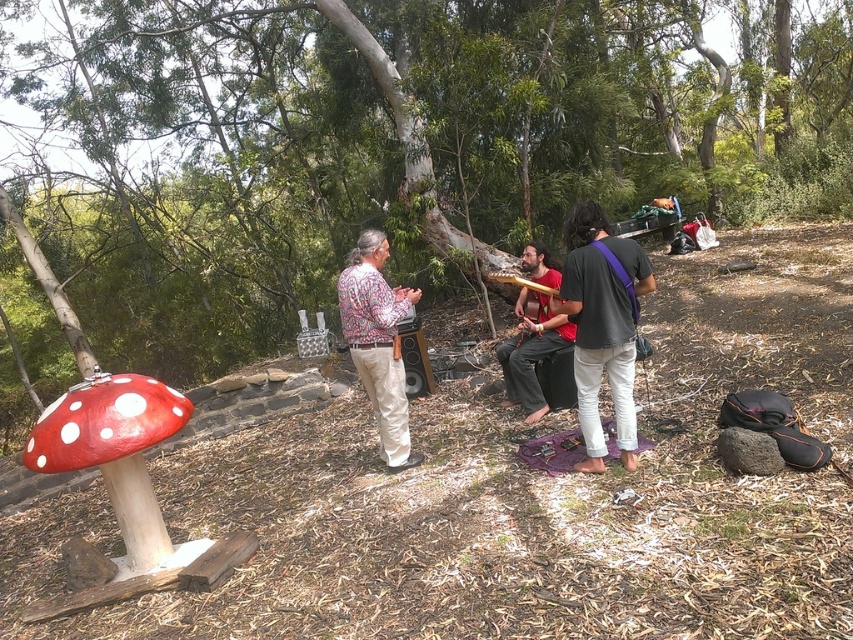
Question: Can you confirm if dark gray fabric guitar at center is thinner than red fabric guitar at center?

Choices:
 (A) yes
 (B) no

Answer: (A)

Question: Which object is closer to the camera taking this photo?

Choices:
 (A) dark gray fabric guitar at center
 (B) red fabric guitar at center
 (C) gold metallic xylophone at center

Answer: (A)

Question: Among these objects, which one is farthest from the camera?

Choices:
 (A) smooth bark tree at center
 (B) floral-patterned shirt at center
 (C) gold metallic xylophone at center
 (D) red fabric guitar at center

Answer: (A)

Question: Can you confirm if floral-patterned shirt at center is wider than red fabric guitar at center?

Choices:
 (A) yes
 (B) no

Answer: (B)

Question: Is floral-patterned shirt at center above red fabric guitar at center?

Choices:
 (A) yes
 (B) no

Answer: (B)

Question: Estimate the real-world distances between objects in this image. Which object is closer to the gold metallic xylophone at center?

Choices:
 (A) dark gray fabric guitar at center
 (B) floral-patterned shirt at center

Answer: (B)